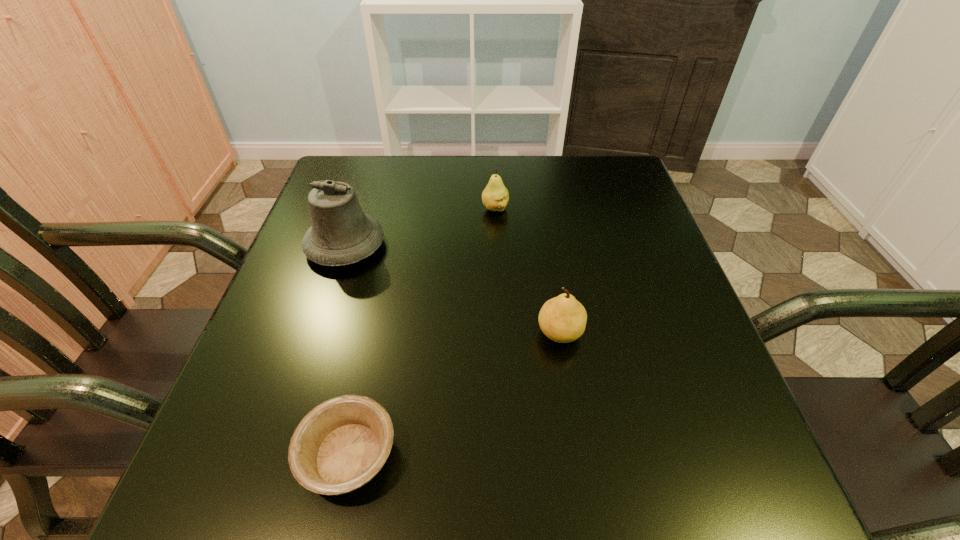
The image size is (960, 540). Identify the location of vacant space located on the left of the farther pear. (444, 208).

In order to click on vacant space positioned on the right of the shortest object in this screenshot , I will do `click(641, 455)`.

Where is `object that is at the far edge`? Image resolution: width=960 pixels, height=540 pixels. object that is at the far edge is located at coordinates (495, 197).

Where is `object that is at the near edge`? object that is at the near edge is located at coordinates (339, 446).

Find the location of a particular element. This screenshot has width=960, height=540. bell located at the left edge is located at coordinates (341, 234).

Where is `bowl located in the left edge section of the desktop`? This screenshot has height=540, width=960. bowl located in the left edge section of the desktop is located at coordinates pos(339,446).

At what (x,y) coordinates should I click in order to perform the action: click on object located in the near left corner section of the desktop. Please return your answer as a coordinate pair (x, y). The height and width of the screenshot is (540, 960). Looking at the image, I should click on (339, 446).

At what (x,y) coordinates should I click in order to perform the action: click on free location at the far edge of the desktop. Please return your answer as a coordinate pair (x, y). Looking at the image, I should click on (529, 203).

Identify the location of vacant area at the near edge. Image resolution: width=960 pixels, height=540 pixels. (430, 506).

In order to click on free region at the left edge of the desktop in this screenshot , I will do [x=235, y=441].